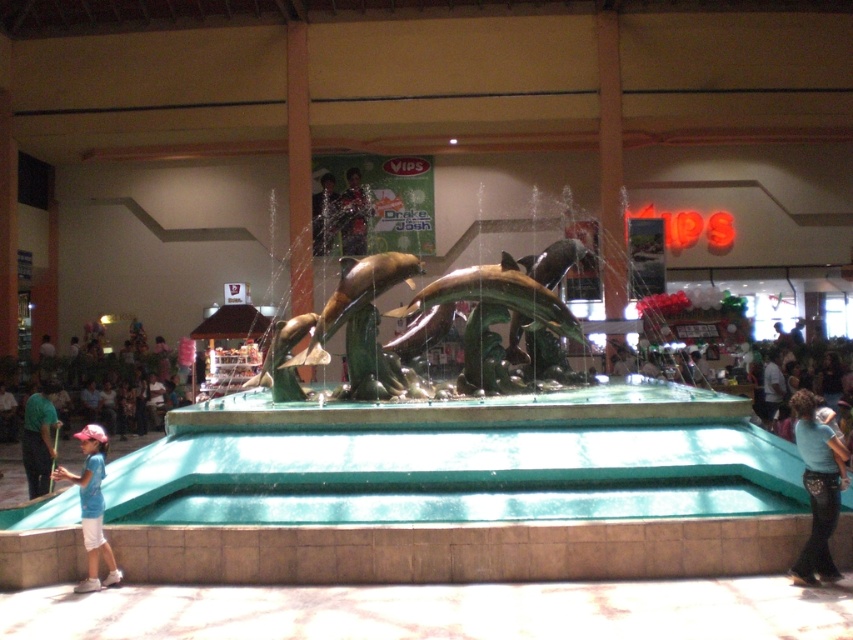
Does blue cotton shirt at lower left have a lesser width compared to green fabric shirt at left?

No.

Is blue cotton shirt at lower left shorter than green fabric shirt at left?

Incorrect, blue cotton shirt at lower left's height does not fall short of green fabric shirt at left's.

Is point (91, 508) closer to viewer compared to point (38, 444)?

Yes, it is in front of point (38, 444).

The image size is (853, 640). I want to click on blue cotton shirt at lower left, so click(91, 506).

Can you confirm if blue denim jeans at lower right is positioned below green fabric shirt at left?

No.

Which is in front, point (815, 518) or point (41, 448)?

Point (815, 518) is in front.

Measure the distance between blue denim jeans at lower right and camera.

blue denim jeans at lower right and camera are 8.32 meters apart.

At what (x,y) coordinates should I click in order to perform the action: click on blue denim jeans at lower right. Please return your answer as a coordinate pair (x, y). Looking at the image, I should click on (817, 488).

Is point (813, 436) farther from camera compared to point (82, 435)?

No, it is not.

Where is `blue denim jeans at lower right`? The height and width of the screenshot is (640, 853). blue denim jeans at lower right is located at coordinates (817, 488).

Locate an element on the screen. This screenshot has width=853, height=640. blue denim jeans at lower right is located at coordinates (817, 488).